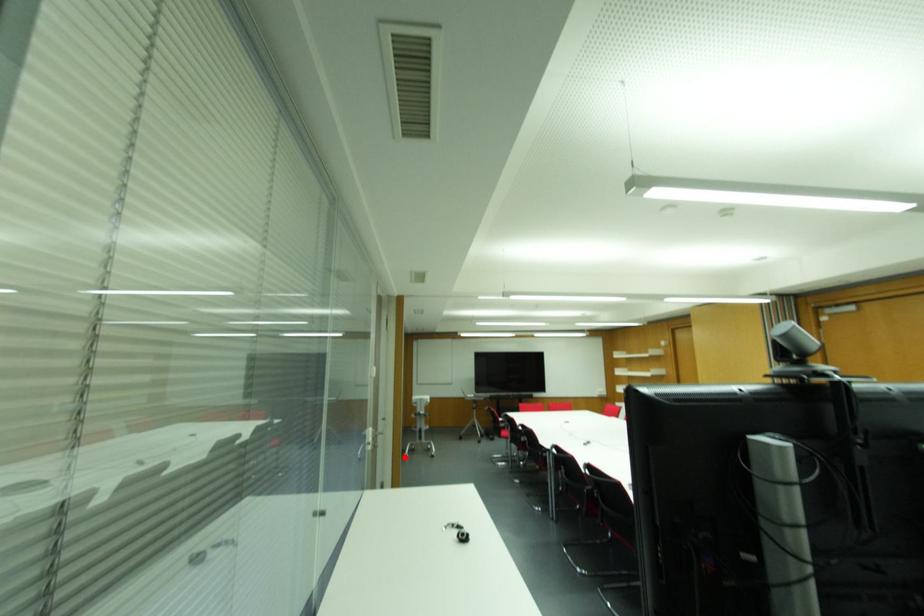
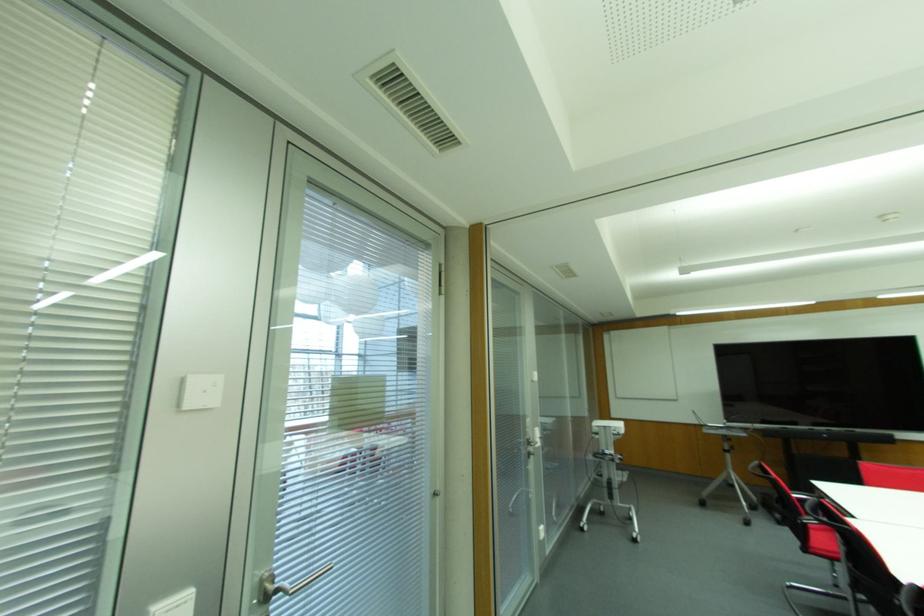
Question: A red point is marked in image1. In image2, is the corresponding 3D point closer to the camera or farther? Reply with the corresponding letter.

Choices:
 (A) The corresponding 3D point is closer.
 (B) The corresponding 3D point is farther.

Answer: (A)